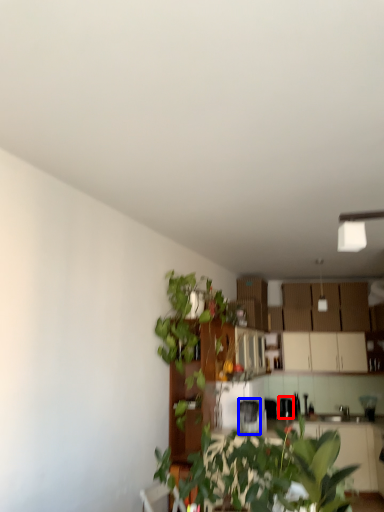
Question: Which point is further to the camera, appliance (highlighted by a red box) or appliance (highlighted by a blue box)?

Choices:
 (A) appliance
 (B) appliance

Answer: (A)